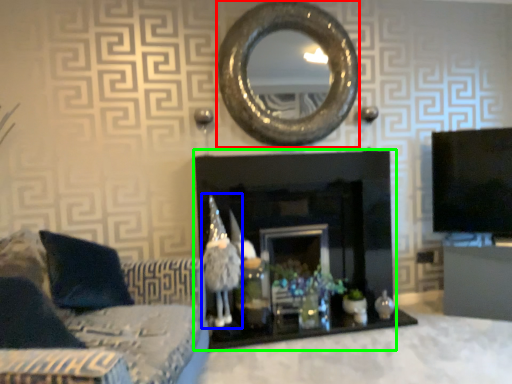
Question: Which object is the farthest from oval (highlighted by a red box)? Choose among these: toy (highlighted by a blue box) or fireplace (highlighted by a green box).

Choices:
 (A) toy
 (B) fireplace

Answer: (A)